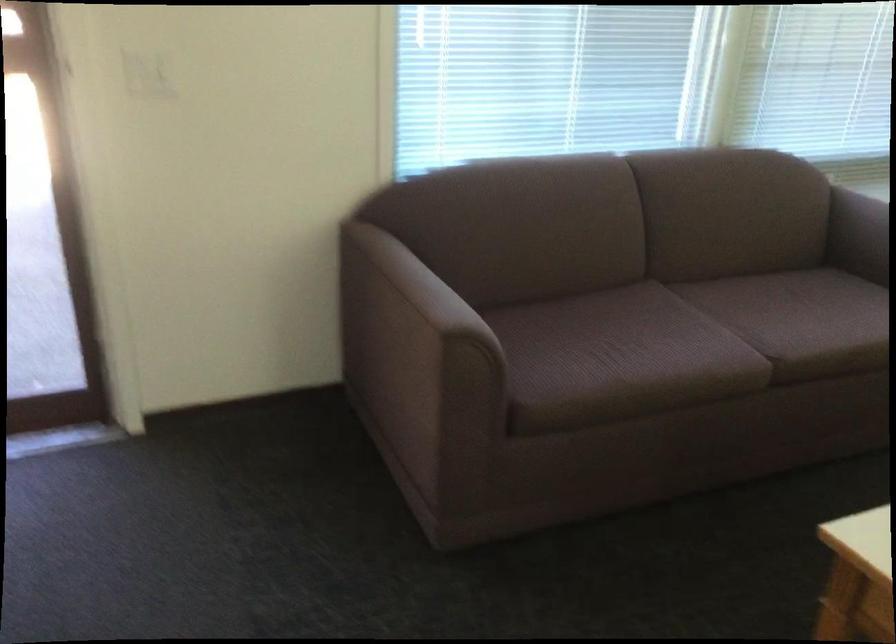
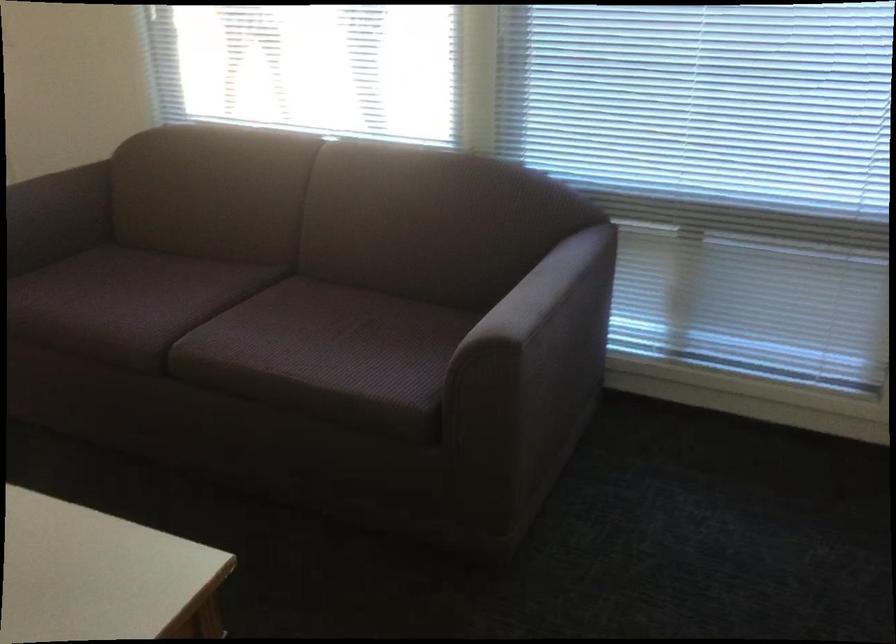
Find the pixel in the second image that matches the point at 624,343 in the first image.

(126, 299)